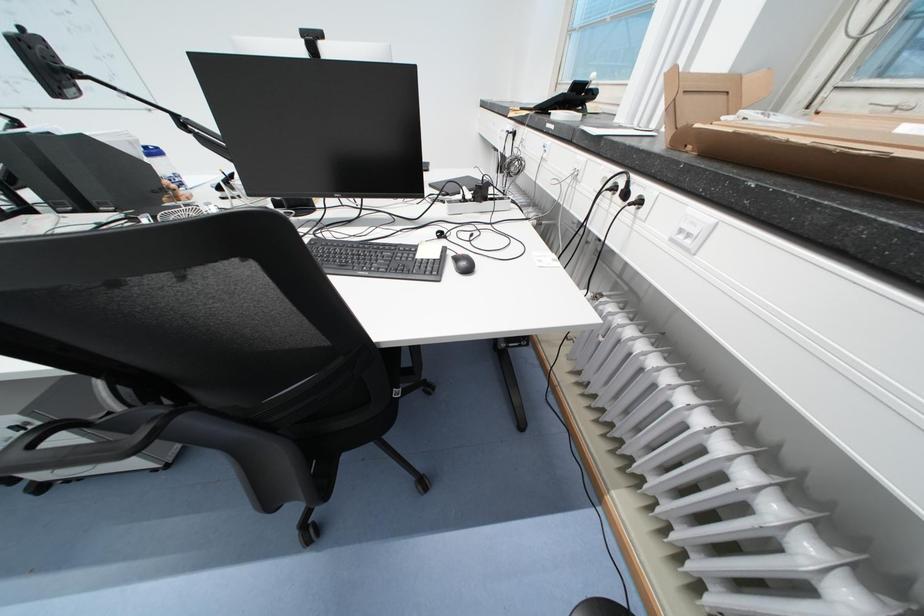
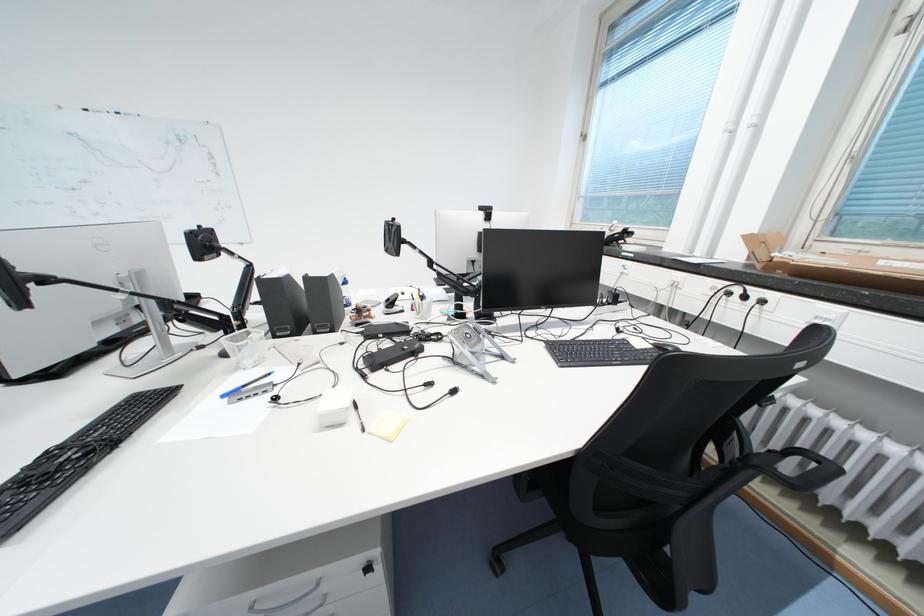
Question: What movement of the cameraman would produce the second image?

Choices:
 (A) Left
 (B) Right
 (C) Forward
 (D) Backward

Answer: (A)